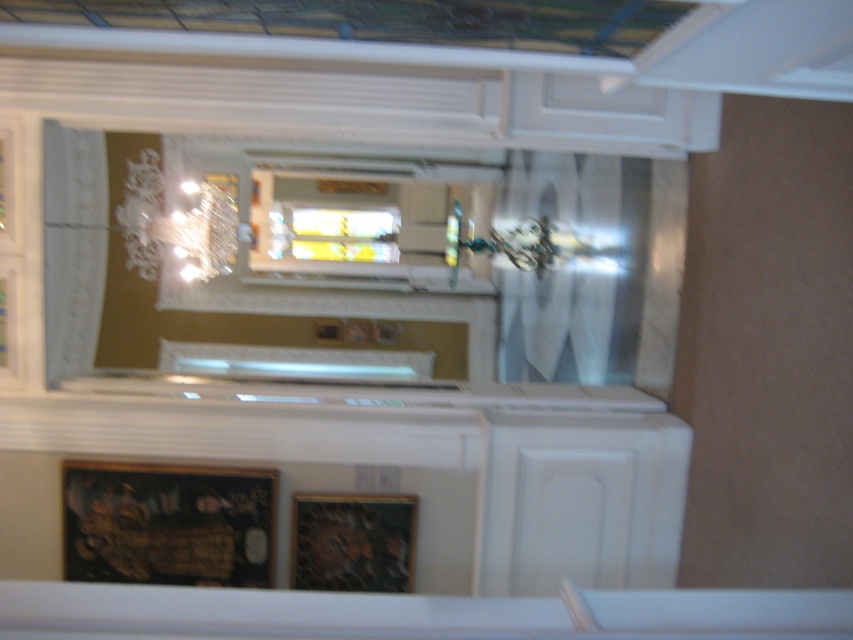
From the picture: You are standing in the room and want to look outside through the clear glass window at center. To do this, do you need to move the white sheer curtain at center out of the way?

The white sheer curtain at center is located below the clear glass window at center, so you don not need to move it to look outside through the window.

You are standing in the room and looking up at the ceiling and walls. There are two points marked on the wall at coordinates point (167, 220) and point (386, 220). Which of these points is closer to your eyes?

Point (167, 220) is closer to the viewer than point (386, 220).